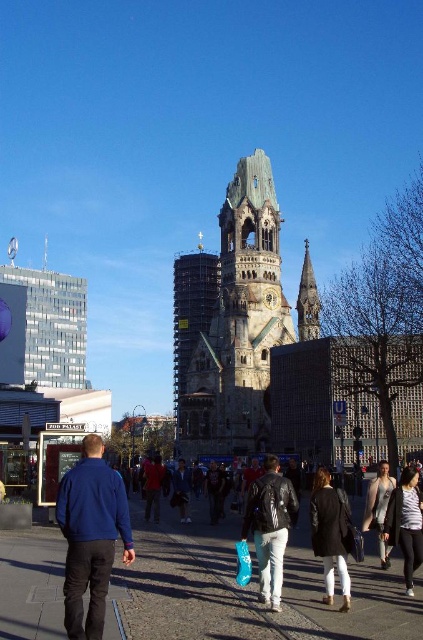
Question: Is the position of black leather jacket at center more distant than that of gray wool coat at center?

Choices:
 (A) yes
 (B) no

Answer: (B)

Question: Does dark brown stone tower at center have a smaller size compared to smooth stone spire at center?

Choices:
 (A) no
 (B) yes

Answer: (A)

Question: Which of the following is the closest to the observer?

Choices:
 (A) red leather jacket at center
 (B) leather jacket at center
 (C) smooth stone spire at center
 (D) blue fleece jacket at lower left

Answer: (D)

Question: Estimate the real-world distances between objects in this image. Which object is closer to the smooth stone spire at center?

Choices:
 (A) leather jacket at center
 (B) gray wool coat at center
 (C) stone clock tower at center

Answer: (C)

Question: From the image, what is the correct spatial relationship of leather jacket at center in relation to smooth stone spire at center?

Choices:
 (A) right
 (B) left

Answer: (B)

Question: Which point appears closest to the camera in this image?

Choices:
 (A) (271, 467)
 (B) (395, 513)

Answer: (A)